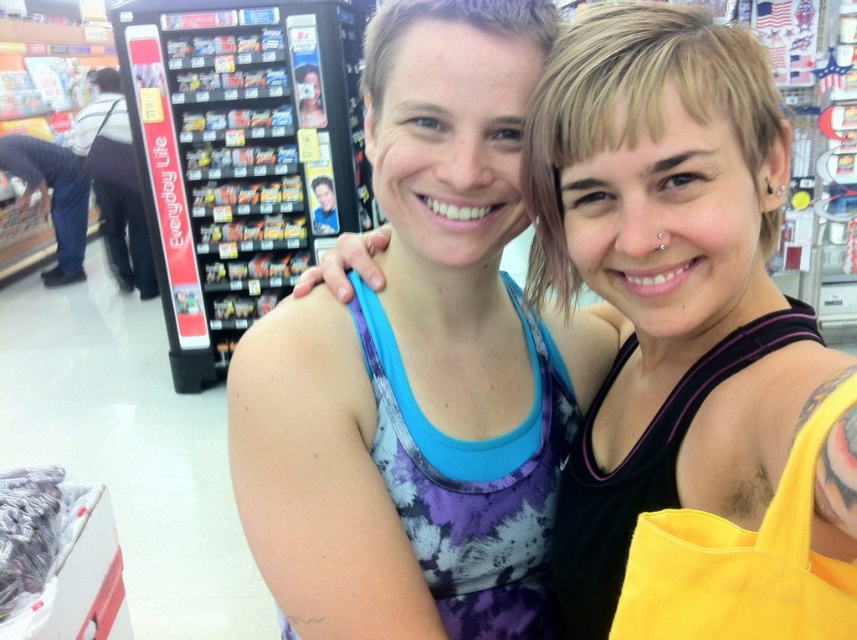
Does purple tie-dye tank top at center have a lesser height compared to yellow fabric bag at lower right?

Incorrect, purple tie-dye tank top at center's height does not fall short of yellow fabric bag at lower right's.

Is point (760, 349) positioned behind point (763, 572)?

Yes.

Find the location of a particular element. Image resolution: width=857 pixels, height=640 pixels. purple tie-dye tank top at center is located at coordinates (688, 342).